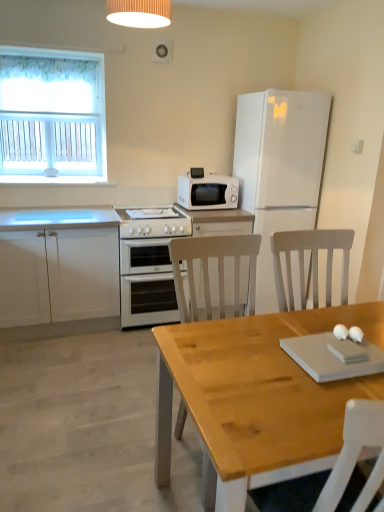
Measure the distance between point (289, 201) and camera.

Point (289, 201) and camera are 10.90 feet apart.

In order to face white matte cabinet at lower left, should I rotate leftwards or rightwards?

It's best to rotate left around 17.976 degrees.

Where is `white fabric curtain at upper left`? white fabric curtain at upper left is located at coordinates (52, 116).

Where is `white ribbed lampshade at upper center`? white ribbed lampshade at upper center is located at coordinates (139, 13).

From a real-world perspective, is white glossy oven at center above or below white glossy gas stove at center?

white glossy oven at center is below white glossy gas stove at center.

In the scene shown: Considering the relative sizes of white glossy oven at center and white glossy gas stove at center in the image provided, is white glossy oven at center wider than white glossy gas stove at center?

Indeed, white glossy oven at center has a greater width compared to white glossy gas stove at center.

Is white glossy oven at center facing away from white glossy gas stove at center?

white glossy oven at center is not turned away from white glossy gas stove at center.

Is white glossy oven at center beside white glossy gas stove at center?

No, white glossy oven at center is not beside white glossy gas stove at center.

What's the angular difference between white glossy oven at center and wooden table at center's facing directions?

The facing directions of white glossy oven at center and wooden table at center are 0.625 degrees apart.

Are white glossy oven at center and wooden table at center far apart?

Yes.

Does point (129, 244) appear closer or farther from the camera than point (158, 426)?

Point (129, 244) is positioned farther from the camera compared to point (158, 426).

Does white ribbed lampshade at upper center appear on the left side of white fabric curtain at upper left?

No.

In terms of width, does white ribbed lampshade at upper center look wider or thinner when compared to white fabric curtain at upper left?

white ribbed lampshade at upper center is wider than white fabric curtain at upper left.

Which of these two, white ribbed lampshade at upper center or white fabric curtain at upper left, stands shorter?

white ribbed lampshade at upper center is shorter.

Is white ribbed lampshade at upper center with white fabric curtain at upper left?

No, white ribbed lampshade at upper center is not with white fabric curtain at upper left.

Which of these two, white matte refrigerator at upper right or white fabric curtain at upper left, is smaller?

white fabric curtain at upper left is smaller.

Looking at this image, can you see white matte refrigerator at upper right touching white fabric curtain at upper left?

No, white matte refrigerator at upper right is not beside white fabric curtain at upper left.

From a real-world perspective, between white matte refrigerator at upper right and white fabric curtain at upper left, who is vertically higher?

white fabric curtain at upper left.

You are a GUI agent. You are given a task and a screenshot of the screen. Output one action in this format:
    pyautogui.click(x=<x>, y=<y>)
    Task: Click on the refrigerator below the white fabric curtain at upper left (from a real-world perspective)
    The height and width of the screenshot is (512, 384).
    Given the screenshot: What is the action you would take?
    click(x=279, y=168)

Considering the relative sizes of wooden table at center and white ribbed lampshade at upper center in the image provided, is wooden table at center bigger than white ribbed lampshade at upper center?

Yes, wooden table at center is bigger than white ribbed lampshade at upper center.

Which of these two, wooden table at center or white ribbed lampshade at upper center, stands shorter?

wooden table at center.

Considering the sizes of objects wooden table at center and white ribbed lampshade at upper center in the image provided, who is thinner, wooden table at center or white ribbed lampshade at upper center?

With smaller width is white ribbed lampshade at upper center.

Is wooden table at center in front of or behind white ribbed lampshade at upper center in the image?

In the image, wooden table at center appears in front of white ribbed lampshade at upper center.

Based on the photo, which of these two, white glossy oven at center or white fabric curtain at upper left, stands shorter?

With less height is white glossy oven at center.

Is white glossy oven at center bigger or smaller than white fabric curtain at upper left?

In the image, white glossy oven at center appears to be larger than white fabric curtain at upper left.

From the image's perspective, is white glossy oven at center under white fabric curtain at upper left?

Yes, from the image's perspective, white glossy oven at center is beneath white fabric curtain at upper left.

Is white glossy oven at center looking in the opposite direction of white fabric curtain at upper left?

No.

Is white glossy gas stove at center shorter than white glossy oven at center?

Yes.

Are white glossy gas stove at center and white glossy oven at center located far from each other?

No, white glossy gas stove at center is not far from white glossy oven at center.

From the image's perspective, which is below, white glossy gas stove at center or white glossy oven at center?

white glossy oven at center is shown below in the image.

Is white glossy gas stove at center oriented away from white glossy oven at center?

No, white glossy gas stove at center's orientation is not away from white glossy oven at center.

Where is `gas stove on the right of white glossy oven at center`? The image size is (384, 512). gas stove on the right of white glossy oven at center is located at coordinates (153, 223).

Where is `table that is below the white glossy oven at center (from the image's perspective)`? table that is below the white glossy oven at center (from the image's perspective) is located at coordinates (256, 399).

Which object lies further to the anchor point white matte microwave at upper center, wooden table at center or white matte cabinet at lower left?

Based on the image, wooden table at center appears to be further to white matte microwave at upper center.

Looking at the image, which one is located further to white glossy gas stove at center, white fabric curtain at upper left or white matte refrigerator at upper right?

white fabric curtain at upper left lies further to white glossy gas stove at center than the other object.

Based on their spatial positions, is white matte microwave at upper center or white matte refrigerator at upper right closer to white matte cabinet at lower left?

The object closer to white matte cabinet at lower left is white matte microwave at upper center.

Looking at the image, which one is located closer to white matte microwave at upper center, white matte refrigerator at upper right or white matte cabinet at lower left?

white matte refrigerator at upper right lies closer to white matte microwave at upper center than the other object.

Based on their spatial positions, is white ribbed lampshade at upper center or white matte refrigerator at upper right closer to white fabric curtain at upper left?

The object closer to white fabric curtain at upper left is white ribbed lampshade at upper center.

Looking at this image, looking at the image, which one is located closer to wooden table at center, white matte cabinet at lower left or white glossy oven at center?

Among the two, white glossy oven at center is located nearer to wooden table at center.

Estimate the real-world distances between objects in this image. Which object is closer to wooden table at center, white fabric curtain at upper left or white matte microwave at upper center?

Based on the image, white matte microwave at upper center appears to be nearer to wooden table at center.

Estimate the real-world distances between objects in this image. Which object is further from white matte refrigerator at upper right, white ribbed lampshade at upper center or white matte cabinet at lower left?

The object further to white matte refrigerator at upper right is white matte cabinet at lower left.

Where is `gas stove located between wooden table at center and white matte refrigerator at upper right in the depth direction`? This screenshot has height=512, width=384. gas stove located between wooden table at center and white matte refrigerator at upper right in the depth direction is located at coordinates (153, 223).

Locate an element on the screen. This screenshot has width=384, height=512. kitchen appliance located between white glossy oven at center and white matte refrigerator at upper right in the left-right direction is located at coordinates (208, 192).

This screenshot has width=384, height=512. In order to click on cabinetry between white ribbed lampshade at upper center and wooden table at center from top to bottom in this screenshot , I will do `click(59, 267)`.

Locate an element on the screen. refrigerator between wooden table at center and white matte microwave at upper center along the z-axis is located at coordinates (279, 168).